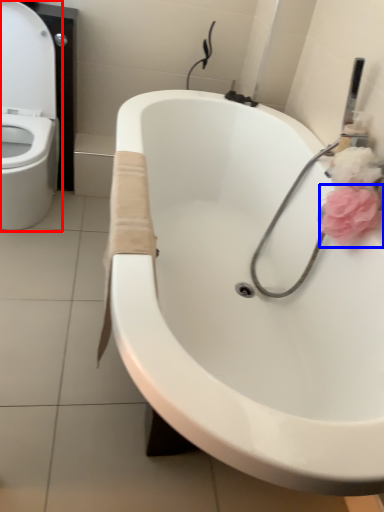
Question: Which object appears closest to the camera in this image, toilet (highlighted by a red box) or flower (highlighted by a blue box)?

Choices:
 (A) toilet
 (B) flower

Answer: (B)